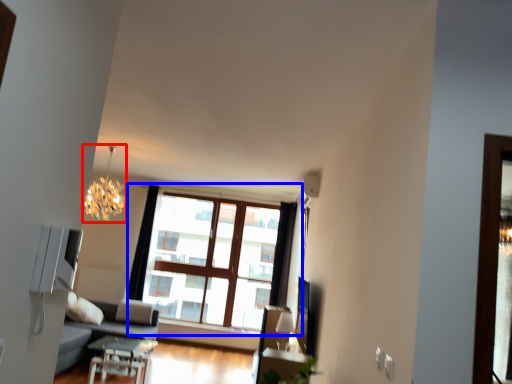
Question: Which of the following is the closest to the observer, lamp (highlighted by a red box) or window (highlighted by a blue box)?

Choices:
 (A) lamp
 (B) window

Answer: (A)